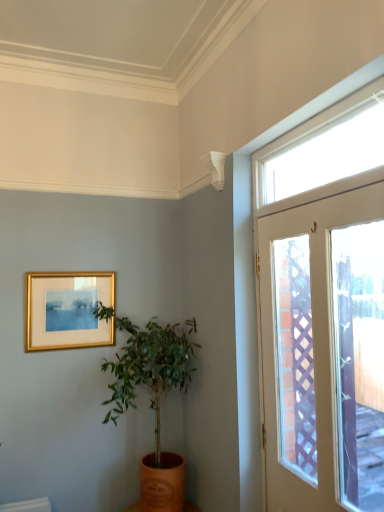
What do you see at coordinates (320, 153) in the screenshot? I see `clear glass window at upper right` at bounding box center [320, 153].

Find the location of a particular element. gold metallic picture frame at upper left is located at coordinates (68, 310).

The width and height of the screenshot is (384, 512). Describe the element at coordinates (68, 310) in the screenshot. I see `gold metallic picture frame at upper left` at that location.

Find the location of a particular element. Image resolution: width=384 pixels, height=512 pixels. clear glass window at upper right is located at coordinates (320, 153).

Which of these two, gold metallic picture frame at upper left or white glossy door at right, stands taller?

white glossy door at right is taller.

Considering the positions of objects gold metallic picture frame at upper left and white glossy door at right in the image provided, who is more to the right, gold metallic picture frame at upper left or white glossy door at right?

white glossy door at right.

How many degrees apart are the facing directions of gold metallic picture frame at upper left and white glossy door at right?

There is a 89-degree angle between the facing directions of gold metallic picture frame at upper left and white glossy door at right.

Can you confirm if clear glass window at upper right is bigger than white glossy door at right?

Incorrect, clear glass window at upper right is not larger than white glossy door at right.

Between clear glass window at upper right and white glossy door at right, which one has larger width?

Wider between the two is clear glass window at upper right.

Based on the photo, relative to white glossy door at right, is clear glass window at upper right in front or behind?

clear glass window at upper right is positioned farther from the viewer than white glossy door at right.

Based on their sizes in the image, would you say white glossy door at right is bigger or smaller than gold metallic picture frame at upper left?

In the image, white glossy door at right appears to be larger than gold metallic picture frame at upper left.

Is gold metallic picture frame at upper left surrounded by white glossy door at right?

No, white glossy door at right does not contain gold metallic picture frame at upper left.

Between white glossy door at right and gold metallic picture frame at upper left, which one appears on the right side from the viewer's perspective?

From the viewer's perspective, white glossy door at right appears more on the right side.

Is clear glass window at upper right positioned with its back to orange clay pot at center?

No, clear glass window at upper right is not facing the opposite direction of orange clay pot at center.

Considering their positions, is clear glass window at upper right located in front of or behind orange clay pot at center?

Clearly, clear glass window at upper right is in front of orange clay pot at center.

Where is `window above the orange clay pot at center (from the image's perspective)`? This screenshot has height=512, width=384. window above the orange clay pot at center (from the image's perspective) is located at coordinates (320, 153).

Which of these two, clear glass window at upper right or orange clay pot at center, is wider?

orange clay pot at center is wider.

Would you say white glossy door at right is inside or outside clear glass window at upper right?

white glossy door at right lies outside clear glass window at upper right.

Based on their sizes in the image, would you say white glossy door at right is bigger or smaller than clear glass window at upper right?

Clearly, white glossy door at right is larger in size than clear glass window at upper right.

Is orange clay pot at center not near white glossy door at right?

No, there isn't a large distance between orange clay pot at center and white glossy door at right.

Between orange clay pot at center and white glossy door at right, which one is positioned in front?

white glossy door at right.

Considering the relative sizes of orange clay pot at center and white glossy door at right in the image provided, is orange clay pot at center shorter than white glossy door at right?

Yes.

From the picture: Who is shorter, orange clay pot at center or gold metallic picture frame at upper left?

Standing shorter between the two is gold metallic picture frame at upper left.

Is orange clay pot at center behind gold metallic picture frame at upper left?

No, it is not.

From the image's perspective, is orange clay pot at center below gold metallic picture frame at upper left?

Yes.

Consider the image. How different are the orientations of orange clay pot at center and gold metallic picture frame at upper left in degrees?

They differ by 0.199 degrees in their facing directions.

Where is `picture frame that is above the white glossy door at right (from a real-world perspective)`? picture frame that is above the white glossy door at right (from a real-world perspective) is located at coordinates (68, 310).

Locate an element on the screen. Image resolution: width=384 pixels, height=512 pixels. door that appears below the clear glass window at upper right (from the image's perspective) is located at coordinates (304, 347).

Looking at the image, which one is located closer to white glossy door at right, orange clay pot at center or gold metallic picture frame at upper left?

orange clay pot at center is closer to white glossy door at right.

Considering their positions, is gold metallic picture frame at upper left positioned closer to clear glass window at upper right than white glossy door at right?

The object closer to clear glass window at upper right is white glossy door at right.

Based on their spatial positions, is white glossy door at right or orange clay pot at center further from gold metallic picture frame at upper left?

white glossy door at right.

Looking at the image, which one is located closer to gold metallic picture frame at upper left, white glossy door at right or clear glass window at upper right?

white glossy door at right lies closer to gold metallic picture frame at upper left than the other object.

Looking at the image, which one is located further to white glossy door at right, orange clay pot at center or clear glass window at upper right?

The object further to white glossy door at right is orange clay pot at center.

Which object lies nearer to the anchor point clear glass window at upper right, white glossy door at right or gold metallic picture frame at upper left?

white glossy door at right.

Estimate the real-world distances between objects in this image. Which object is closer to gold metallic picture frame at upper left, clear glass window at upper right or orange clay pot at center?

orange clay pot at center.

Based on the photo, which object lies further to the anchor point orange clay pot at center, clear glass window at upper right or gold metallic picture frame at upper left?

clear glass window at upper right is positioned further to the anchor orange clay pot at center.

Where is `picture frame that lies between clear glass window at upper right and orange clay pot at center from top to bottom`? The image size is (384, 512). picture frame that lies between clear glass window at upper right and orange clay pot at center from top to bottom is located at coordinates (68, 310).

Find the location of `door between clear glass window at upper right and orange clay pot at center from top to bottom`. door between clear glass window at upper right and orange clay pot at center from top to bottom is located at coordinates (304, 347).

Where is `window between gold metallic picture frame at upper left and white glossy door at right in the horizontal direction`? This screenshot has width=384, height=512. window between gold metallic picture frame at upper left and white glossy door at right in the horizontal direction is located at coordinates (320, 153).

The width and height of the screenshot is (384, 512). Find the location of `houseplant between gold metallic picture frame at upper left and white glossy door at right in the horizontal direction`. houseplant between gold metallic picture frame at upper left and white glossy door at right in the horizontal direction is located at coordinates (151, 391).